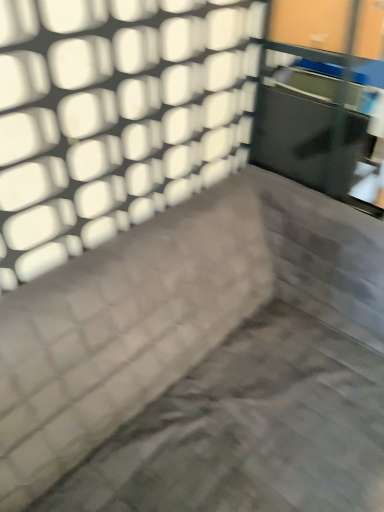
Question: Can you confirm if transparent glass door at upper right is thinner than dark gray fabric couch at center?

Choices:
 (A) yes
 (B) no

Answer: (A)

Question: Can you confirm if transparent glass door at upper right is taller than dark gray fabric couch at center?

Choices:
 (A) yes
 (B) no

Answer: (B)

Question: From the image's perspective, is transparent glass door at upper right on dark gray fabric couch at center?

Choices:
 (A) no
 (B) yes

Answer: (B)

Question: Is transparent glass door at upper right turned away from dark gray fabric couch at center?

Choices:
 (A) yes
 (B) no

Answer: (B)

Question: From a real-world perspective, is transparent glass door at upper right beneath dark gray fabric couch at center?

Choices:
 (A) no
 (B) yes

Answer: (A)

Question: Is transparent glass door at upper right further to the viewer compared to dark gray fabric couch at center?

Choices:
 (A) yes
 (B) no

Answer: (A)

Question: From a real-world perspective, is dark gray fabric couch at center located beneath transparent glass door at upper right?

Choices:
 (A) yes
 (B) no

Answer: (A)

Question: Can you confirm if dark gray fabric couch at center is thinner than transparent glass door at upper right?

Choices:
 (A) no
 (B) yes

Answer: (A)

Question: Considering the relative sizes of dark gray fabric couch at center and transparent glass door at upper right in the image provided, is dark gray fabric couch at center shorter than transparent glass door at upper right?

Choices:
 (A) no
 (B) yes

Answer: (A)

Question: Is dark gray fabric couch at center to the right of transparent glass door at upper right from the viewer's perspective?

Choices:
 (A) yes
 (B) no

Answer: (B)

Question: Considering the relative sizes of dark gray fabric couch at center and transparent glass door at upper right in the image provided, is dark gray fabric couch at center bigger than transparent glass door at upper right?

Choices:
 (A) yes
 (B) no

Answer: (A)

Question: Can you see dark gray fabric couch at center touching transparent glass door at upper right?

Choices:
 (A) yes
 (B) no

Answer: (B)

Question: Would you say dark gray fabric couch at center is to the left or to the right of transparent glass door at upper right in the picture?

Choices:
 (A) left
 (B) right

Answer: (A)